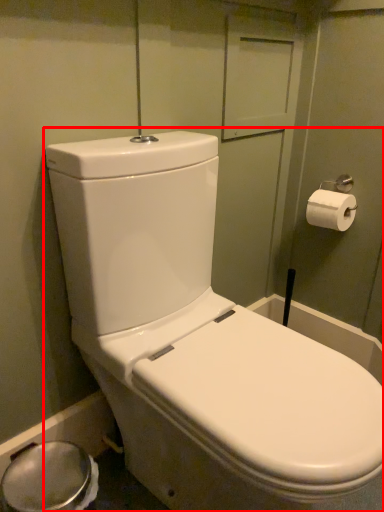
Question: From the image's perspective, where is toilet (annotated by the red box) located relative to toilet paper?

Choices:
 (A) below
 (B) above

Answer: (A)